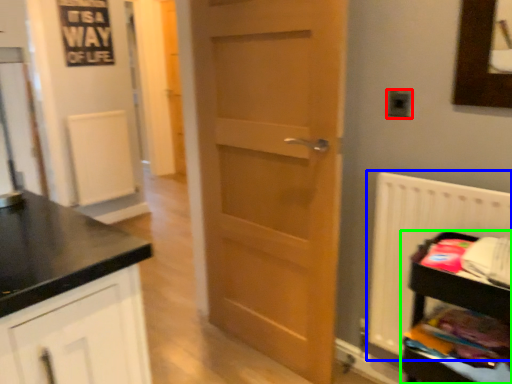
Question: Which object is the closest to the electric outlet (highlighted by a red box)? Choose among these: radiator (highlighted by a blue box) or shelf (highlighted by a green box).

Choices:
 (A) radiator
 (B) shelf

Answer: (A)